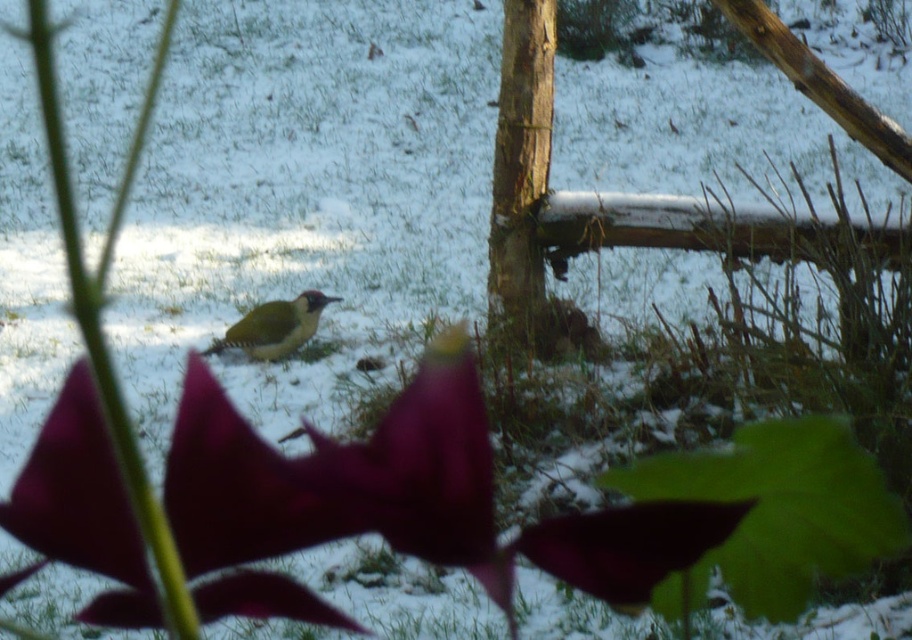
You are a birdwatcher trying to identify the tree species in the image. The smooth bark tree trunk at center is represented by point (520,172). Based on the position of this point, can you determine if the tree trunk is closer to the foreground or the background?

The smooth bark tree trunk at center is represented by point (520,172). Since the coordinates are at the center of the image, it is likely positioned in the midground, between the foreground and background elements described in the scene.

You are standing in a snowy field and want to take a photo of the smooth bark tree trunk at center. If your camera has a maximum focus range of 20 feet, will you need to move closer or farther away to capture it clearly?

The smooth bark tree trunk at center is 20.58 feet away from the viewer. Since the camera can only focus up to 20 feet, you need to move closer to ensure it falls within the camera range.